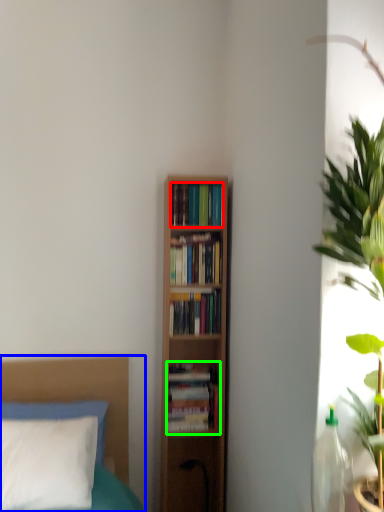
Question: Which object is the farthest from book (highlighted by a red box)? Choose among these: bed (highlighted by a blue box) or book (highlighted by a green box).

Choices:
 (A) bed
 (B) book

Answer: (A)